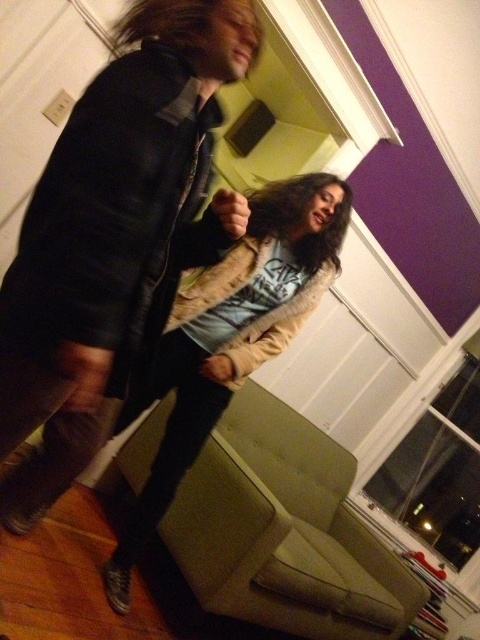
Question: Does black leather jacket at upper left have a larger size compared to fuzzy beige coat at center?

Choices:
 (A) yes
 (B) no

Answer: (B)

Question: From the image, what is the correct spatial relationship of black leather jacket at upper left in relation to fuzzy beige coat at center?

Choices:
 (A) left
 (B) right

Answer: (A)

Question: Which object is closer to the camera taking this photo?

Choices:
 (A) black leather jacket at upper left
 (B) fuzzy beige coat at center

Answer: (A)

Question: Is black leather jacket at upper left smaller than fuzzy beige coat at center?

Choices:
 (A) yes
 (B) no

Answer: (A)